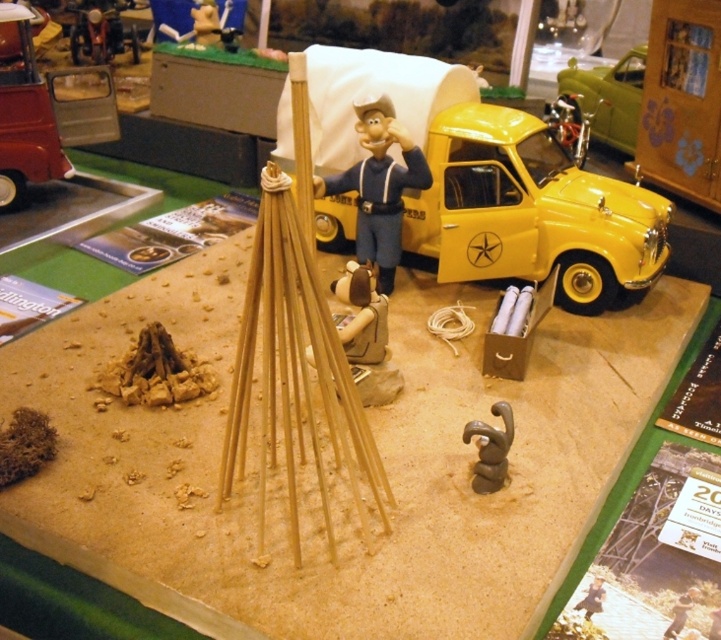
Consider the image. You are a child visiting the museum and see the miniature diorama. You want to place a small action figure between the yellow matte toy car at upper right and the brown clay figurine at lower right. Which object should you place the action figure closer to if you want it to be near the larger object?

The yellow matte toy car at upper right is bigger than the brown clay figurine at lower right, so you should place the action figure closer to the yellow matte toy car at upper right.

You are a visitor at the museum exhibit and want to take a photo of the diorama. You notice two points marked in the scene. From your current position, which point is closer to you? The points are labeled as point (441, 282) and point (508, 445).

Point (441, 282) is further to the camera than point (508, 445), so the point closer to you is point (508, 445).

You are a visitor observing the miniature diorama. You notice the green metallic car at upper right and the wooden stick at lower right. Which object is taller in the scene?

The green metallic car at upper right is taller than the wooden stick at lower right.